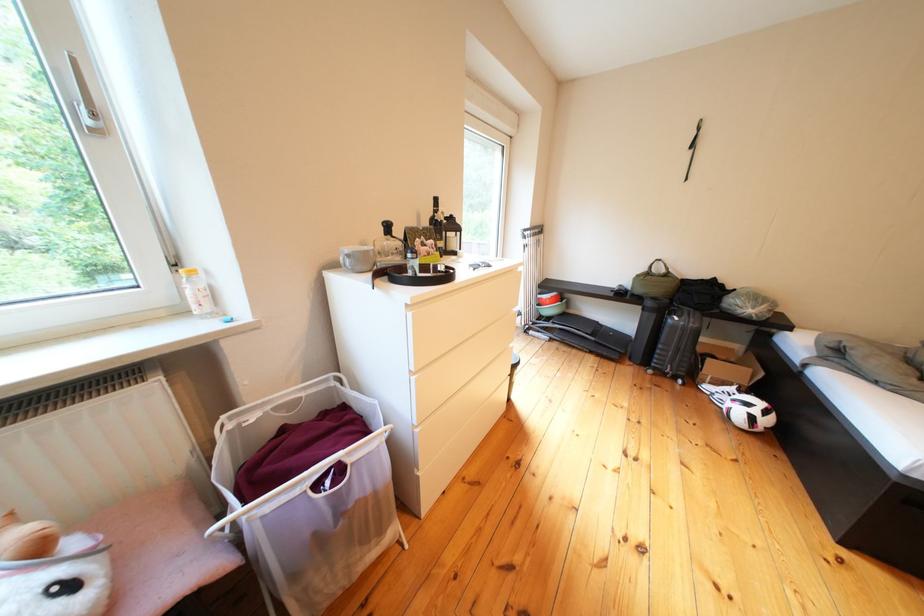
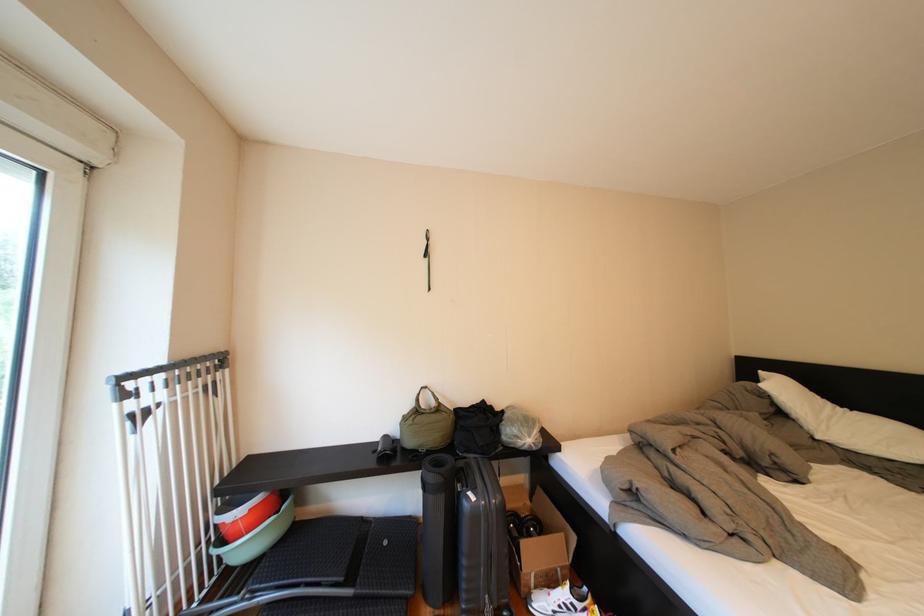
Locate, in the second image, the point that corresponds to (563,315) in the first image.

(261, 551)